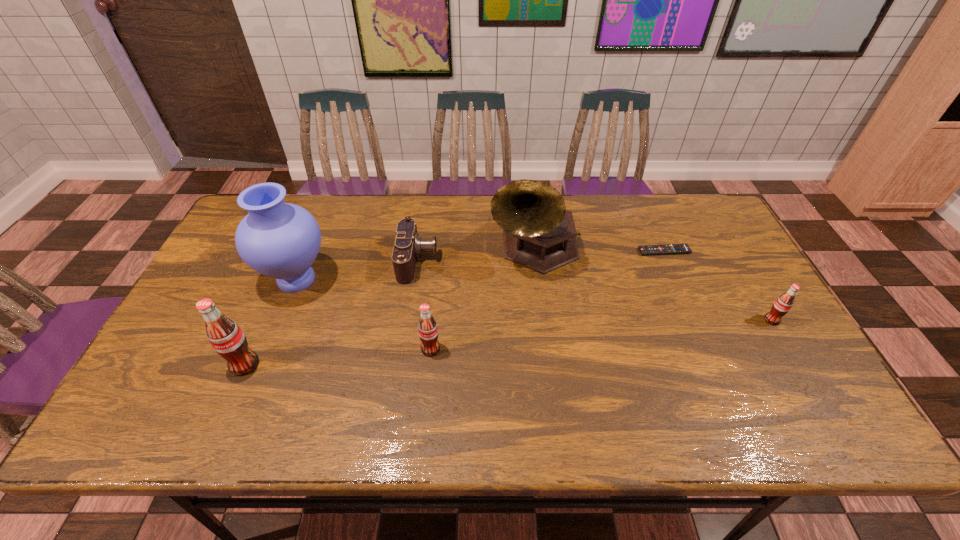
Locate an element on the screen. Image resolution: width=960 pixels, height=540 pixels. soda that is the closest one to the third shortest object is located at coordinates (428, 333).

Identify which soda is located as the nearest to the second shortest object. Please provide its 2D coordinates. Your answer should be formatted as a tuple, i.e. [(x, y)], where the tuple contains the x and y coordinates of a point satisfying the conditions above.

[(428, 333)]

Where is `blank area in the image that satisfies the following two spatial constraints: 1. on the back side of the second shortest soda; 2. on the right side of the shortest soda`? This screenshot has height=540, width=960. blank area in the image that satisfies the following two spatial constraints: 1. on the back side of the second shortest soda; 2. on the right side of the shortest soda is located at coordinates (433, 320).

Identify the location of vacant space that satisfies the following two spatial constraints: 1. on the horn direction of the fifth object from left to right; 2. on the front-facing side of the second shortest object. This screenshot has width=960, height=540. (536, 261).

Locate an element on the screen. vacant area in the image that satisfies the following two spatial constraints: 1. on the front-facing side of the second shortest object; 2. on the right side of the fourth shortest object is located at coordinates (405, 349).

The height and width of the screenshot is (540, 960). Find the location of `free space that satisfies the following two spatial constraints: 1. on the front-facing side of the camera; 2. on the right side of the rightmost object`. free space that satisfies the following two spatial constraints: 1. on the front-facing side of the camera; 2. on the right side of the rightmost object is located at coordinates click(409, 320).

Identify the location of vacant space that satisfies the following two spatial constraints: 1. on the horn direction of the rightmost soda; 2. on the right side of the third object from right to left. (543, 320).